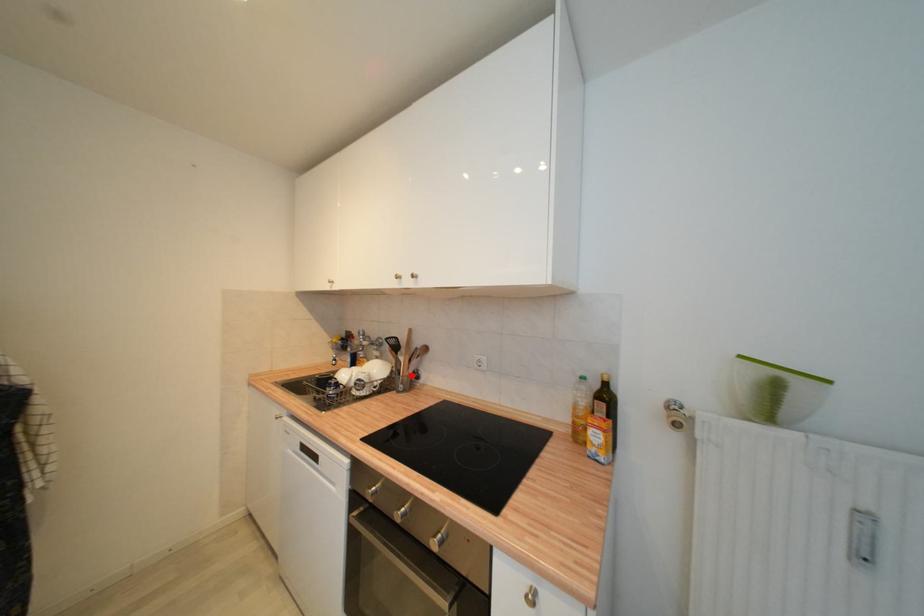
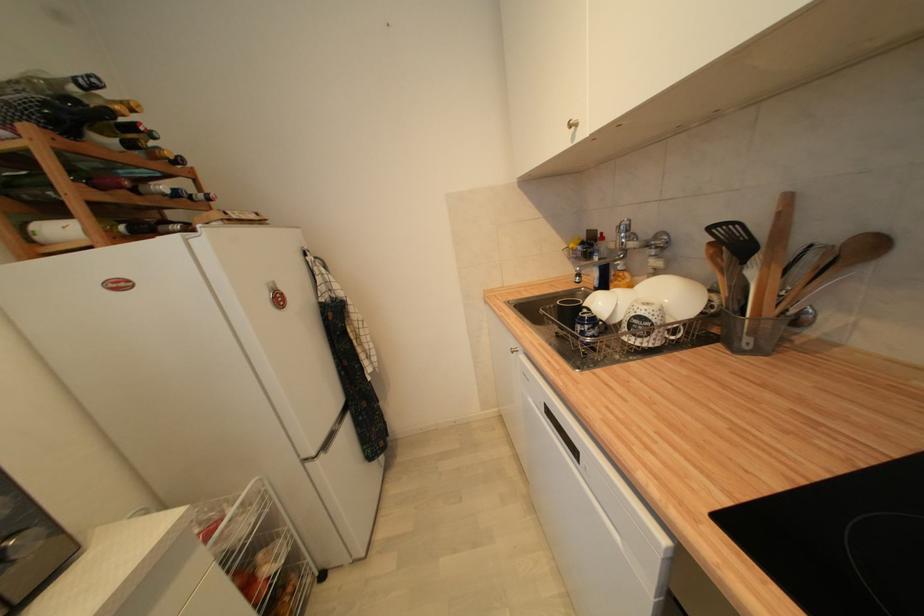
The point at the highlighted location is marked in the first image. Where is the corresponding point in the second image?

(775, 314)